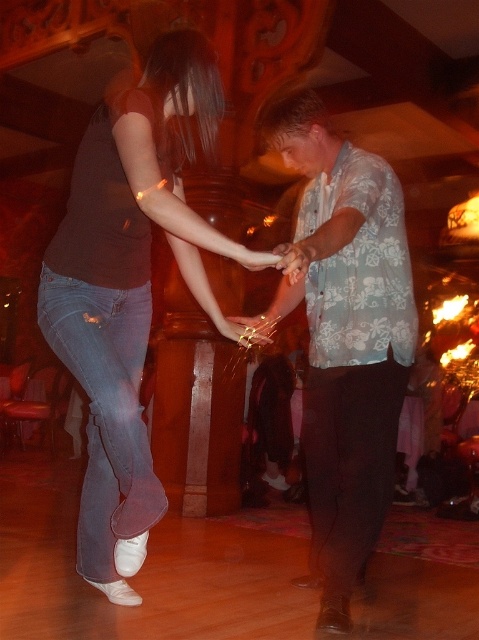
You are a photographer at the party and want to capture a closeup of the floral print shirt at center and denim at left. Since you can only focus on one object at a time, which one should you choose to ensure the subject is in focus given their sizes?

The floral print shirt at center is larger in size than the denim at left, so focusing on the floral print shirt at center would ensure the subject is in focus as it occupies more space in the frame.

You are a photographer at the dance event and want to capture a photo of both the floral print shirt at center and denim at left. Since you want to focus on the wider subject, which one should you prioritize in your composition?

The floral print shirt at center should be prioritized as it is wider than the denim at left.